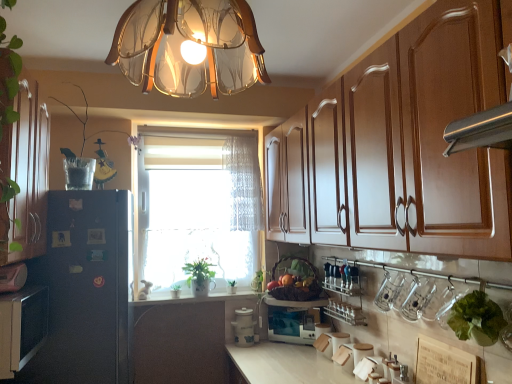
Question: Can you confirm if green leafy plant at window, which ranks as the third plant in front-to-back order, is thinner than matte black microwave at center, which is the first appliance from right to left?

Choices:
 (A) no
 (B) yes

Answer: (B)

Question: Can you confirm if green leafy plant at window, which is the second plant in back-to-front order, is positioned to the left of matte black microwave at center, which is the first appliance from right to left?

Choices:
 (A) yes
 (B) no

Answer: (A)

Question: From the image's perspective, is green leafy plant at window, acting as the first plant starting from the bottom, below matte black microwave at center, which is the first appliance from right to left?

Choices:
 (A) no
 (B) yes

Answer: (A)

Question: Considering the relative sizes of green leafy plant at window, which is counted as the second plant, starting from the left, and matte black microwave at center, which is the first appliance from right to left, in the image provided, is green leafy plant at window, which is counted as the second plant, starting from the left, wider than matte black microwave at center, which is the first appliance from right to left,?

Choices:
 (A) no
 (B) yes

Answer: (A)

Question: Considering the relative positions of green leafy plant at window, which ranks as the third plant in front-to-back order, and matte black microwave at center, the second appliance in the left-to-right sequence, in the image provided, is green leafy plant at window, which ranks as the third plant in front-to-back order, to the right of matte black microwave at center, the second appliance in the left-to-right sequence, from the viewer's perspective?

Choices:
 (A) yes
 (B) no

Answer: (B)

Question: Considering the positions of point (463, 69) and point (346, 281), is point (463, 69) closer or farther from the camera than point (346, 281)?

Choices:
 (A) closer
 (B) farther

Answer: (A)

Question: In terms of size, does brown wood cabinet at upper right, which is the first cabinetry from right to left, appear bigger or smaller than metallic silver spice rack at lower center?

Choices:
 (A) small
 (B) big

Answer: (B)

Question: From the image's perspective, is brown wood cabinet at upper right, which is the first cabinetry from right to left, located above or below metallic silver spice rack at lower center?

Choices:
 (A) below
 (B) above

Answer: (B)

Question: Looking at their shapes, would you say brown wood cabinet at upper right, positioned as the 3th cabinetry in left-to-right order, is wider or thinner than metallic silver spice rack at lower center?

Choices:
 (A) wide
 (B) thin

Answer: (A)

Question: From the image's perspective, is black matte refrigerator at left positioned above or below translucent glass vase at left, the first plant in the left-to-right sequence?

Choices:
 (A) below
 (B) above

Answer: (A)

Question: In the image, is black matte refrigerator at left on the left side or the right side of translucent glass vase at left, the 3th plant viewed from the back?

Choices:
 (A) right
 (B) left

Answer: (B)

Question: Considering their positions, is black matte refrigerator at left located in front of or behind translucent glass vase at left, which is the fourth plant from bottom to top?

Choices:
 (A) front
 (B) behind

Answer: (A)

Question: Considering the positions of black matte refrigerator at left and translucent glass vase at left, which is the fourth plant from bottom to top, in the image, is black matte refrigerator at left bigger or smaller than translucent glass vase at left, which is the fourth plant from bottom to top,?

Choices:
 (A) big
 (B) small

Answer: (A)

Question: In the image, is white ceramic container at center, which is counted as the 1th appliance, starting from the left, positioned in front of or behind green leafy plant at window, which is counted as the 2th plant, starting from the bottom?

Choices:
 (A) front
 (B) behind

Answer: (A)

Question: From the image's perspective, is white ceramic container at center, the second appliance in the right-to-left sequence, located above or below green leafy plant at window, the 3th plant when ordered from top to bottom?

Choices:
 (A) above
 (B) below

Answer: (B)